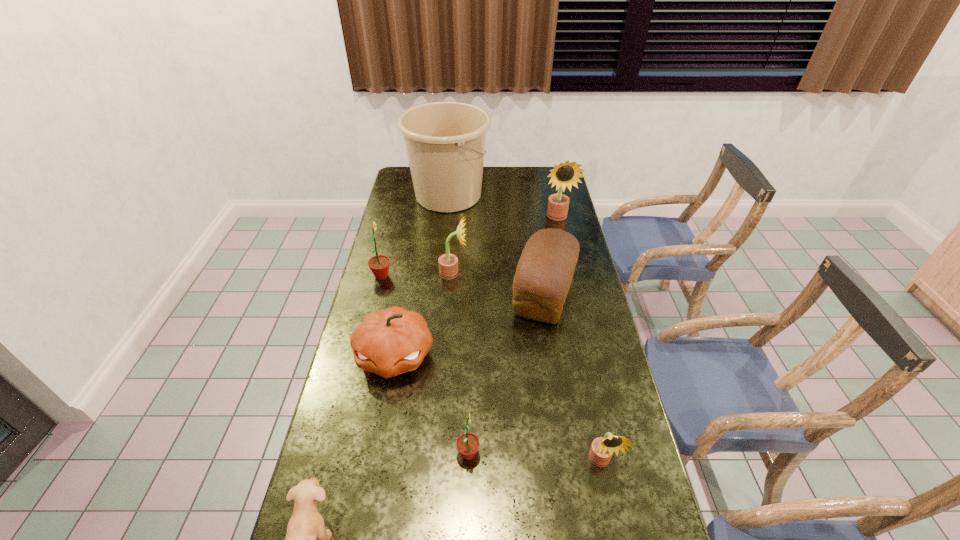
Where is `vacant space in between the brown bread and the leftmost sunflower`? The image size is (960, 540). vacant space in between the brown bread and the leftmost sunflower is located at coordinates (463, 285).

At what (x,y) coordinates should I click in order to perform the action: click on free space between the second smallest yellow sunflower and the farthest sunflower. Please return your answer as a coordinate pair (x, y). Looking at the image, I should click on (505, 245).

The width and height of the screenshot is (960, 540). What are the coordinates of `free space between the tallest sunflower and the right green sunflower` in the screenshot? It's located at (513, 335).

The height and width of the screenshot is (540, 960). Find the location of `free area in between the nearer green sunflower and the leftmost sunflower`. free area in between the nearer green sunflower and the leftmost sunflower is located at coordinates [x=425, y=364].

What are the coordinates of `free space between the farthest sunflower and the bucket` in the screenshot? It's located at (503, 206).

Locate an element on the screen. The image size is (960, 540). vacant area that lies between the left green sunflower and the bread is located at coordinates (463, 285).

You are a GUI agent. You are given a task and a screenshot of the screen. Output one action in this format:
    pyautogui.click(x=<x>, y=<y>)
    Task: Click on the object that stands as the sixth closest to the bread
    This screenshot has width=960, height=540.
    Given the screenshot: What is the action you would take?
    pyautogui.click(x=467, y=444)

Locate which object ranks fifth in proximity to the nearest object. Please provide its 2D coordinates. Your answer should be formatted as a tuple, i.e. [(x, y)], where the tuple contains the x and y coordinates of a point satisfying the conditions above.

[(379, 264)]

Choose which sunflower is the fourth nearest neighbor to the nearest yellow sunflower. Please provide its 2D coordinates. Your answer should be formatted as a tuple, i.e. [(x, y)], where the tuple contains the x and y coordinates of a point satisfying the conditions above.

[(566, 173)]

Locate an element on the screen. Image resolution: width=960 pixels, height=540 pixels. sunflower that is the second closest to the leftmost sunflower is located at coordinates (566, 173).